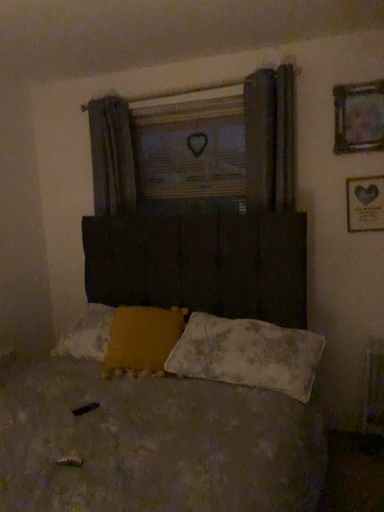
Measure the distance between point [110,376] and camera.

The depth of point [110,376] is 2.16 meters.

How much space does metallic silver picture frame at upper right, the 2th picture frame when ordered from bottom to top, occupy vertically?

The height of metallic silver picture frame at upper right, the 2th picture frame when ordered from bottom to top, is 14.92 inches.

At what (x,y) coordinates should I click in order to perform the action: click on worn fabric bed at center. Please return your answer as a coordinate pair (x, y). This screenshot has height=512, width=384. Looking at the image, I should click on (155, 445).

What do you see at coordinates (365, 204) in the screenshot? The width and height of the screenshot is (384, 512). I see `gold metallic picture frame at upper right, the 1th picture frame positioned from the bottom` at bounding box center [365, 204].

Locate an element on the screen. Image resolution: width=384 pixels, height=512 pixels. worn fabric pillow at lower center, arranged as the 2th pillow when viewed from the left is located at coordinates coord(247,354).

Considering the relative positions of metallic silver picture frame at upper right, the 2th picture frame when ordered from bottom to top, and wooden heart at center in the image provided, is metallic silver picture frame at upper right, the 2th picture frame when ordered from bottom to top, to the left or to the right of wooden heart at center?

From the image, it's evident that metallic silver picture frame at upper right, the 2th picture frame when ordered from bottom to top, is to the right of wooden heart at center.

From the image's perspective, relative to wooden heart at center, is metallic silver picture frame at upper right, the 1th picture frame from the top, above or below?

metallic silver picture frame at upper right, the 1th picture frame from the top, is situated higher than wooden heart at center in the image.

From a real-world perspective, is metallic silver picture frame at upper right, the 2th picture frame when ordered from bottom to top, physically below wooden heart at center?

No, from a real-world perspective, metallic silver picture frame at upper right, the 2th picture frame when ordered from bottom to top, is not below wooden heart at center.

Where is `window screen that is below the metallic silver picture frame at upper right, the 1th picture frame from the top (from the image's perspective)`? The width and height of the screenshot is (384, 512). window screen that is below the metallic silver picture frame at upper right, the 1th picture frame from the top (from the image's perspective) is located at coordinates (190, 148).

In the scene shown: Based on their positions, is metallic silver picture frame at upper right, the 2th picture frame when ordered from bottom to top, located to the left or right of gold metallic picture frame at upper right, the 1th picture frame positioned from the bottom?

Based on their positions, metallic silver picture frame at upper right, the 2th picture frame when ordered from bottom to top, is located to the left of gold metallic picture frame at upper right, the 1th picture frame positioned from the bottom.

Is metallic silver picture frame at upper right, the 1th picture frame from the top, facing away from gold metallic picture frame at upper right, the 1th picture frame positioned from the bottom?

No, metallic silver picture frame at upper right, the 1th picture frame from the top, is not facing away from gold metallic picture frame at upper right, the 1th picture frame positioned from the bottom.

In the scene shown: Would you say metallic silver picture frame at upper right, the 1th picture frame from the top, is outside gold metallic picture frame at upper right, which is the 2th picture frame in top-to-bottom order?

Yes, metallic silver picture frame at upper right, the 1th picture frame from the top, is outside of gold metallic picture frame at upper right, which is the 2th picture frame in top-to-bottom order.

Considering the sizes of objects metallic silver picture frame at upper right, the 1th picture frame from the top, and gold metallic picture frame at upper right, which is the 2th picture frame in top-to-bottom order, in the image provided, who is thinner, metallic silver picture frame at upper right, the 1th picture frame from the top, or gold metallic picture frame at upper right, which is the 2th picture frame in top-to-bottom order,?

gold metallic picture frame at upper right, which is the 2th picture frame in top-to-bottom order, is thinner.

From the image's perspective, between yellow fuzzy pillow at lower center, which is the first pillow from left to right, and worn fabric bed at center, who is located below?

worn fabric bed at center is shown below in the image.

How many degrees apart are the facing directions of yellow fuzzy pillow at lower center, which is the first pillow from left to right, and worn fabric bed at center?

The angle between the facing direction of yellow fuzzy pillow at lower center, which is the first pillow from left to right, and the facing direction of worn fabric bed at center is 17.7 degrees.

In terms of height, does yellow fuzzy pillow at lower center, positioned as the 2th pillow in right-to-left order, look taller or shorter compared to worn fabric bed at center?

yellow fuzzy pillow at lower center, positioned as the 2th pillow in right-to-left order, is shorter than worn fabric bed at center.

Who is bigger, yellow fuzzy pillow at lower center, positioned as the 2th pillow in right-to-left order, or worn fabric bed at center?

worn fabric bed at center.

Looking at the image, does gold metallic picture frame at upper right, which is the 2th picture frame in top-to-bottom order, seem bigger or smaller compared to metallic silver picture frame at upper right, the 1th picture frame from the top?

Considering their sizes, gold metallic picture frame at upper right, which is the 2th picture frame in top-to-bottom order, takes up less space than metallic silver picture frame at upper right, the 1th picture frame from the top.

From a real-world perspective, is gold metallic picture frame at upper right, the 1th picture frame positioned from the bottom, physically located above or below metallic silver picture frame at upper right, the 2th picture frame when ordered from bottom to top?

gold metallic picture frame at upper right, the 1th picture frame positioned from the bottom, is situated lower than metallic silver picture frame at upper right, the 2th picture frame when ordered from bottom to top, in the real world.

Measure the distance from gold metallic picture frame at upper right, the 1th picture frame positioned from the bottom, to metallic silver picture frame at upper right, the 2th picture frame when ordered from bottom to top.

They are 12.64 inches apart.

Is point (382, 198) positioned in front of point (336, 124)?

Yes, it is in front of point (336, 124).

Considering the positions of point (379, 201) and point (67, 368), is point (379, 201) closer or farther from the camera than point (67, 368)?

Point (379, 201) appears to be farther away from the viewer than point (67, 368).

From the image's perspective, which is below, gold metallic picture frame at upper right, the 1th picture frame positioned from the bottom, or worn fabric bed at center?

worn fabric bed at center is shown below in the image.

Does gold metallic picture frame at upper right, which is the 2th picture frame in top-to-bottom order, appear on the right side of worn fabric bed at center?

Yes.

From a real-world perspective, is gold metallic picture frame at upper right, the 1th picture frame positioned from the bottom, positioned over worn fabric bed at center based on gravity?

Yes, from a real-world perspective, gold metallic picture frame at upper right, the 1th picture frame positioned from the bottom, is above worn fabric bed at center.

Considering the positions of objects gold metallic picture frame at upper right, the 1th picture frame positioned from the bottom, and worn fabric pillow at lower center, arranged as the 2th pillow when viewed from the left, in the image provided, who is behind, gold metallic picture frame at upper right, the 1th picture frame positioned from the bottom, or worn fabric pillow at lower center, arranged as the 2th pillow when viewed from the left,?

Positioned behind is gold metallic picture frame at upper right, the 1th picture frame positioned from the bottom.

From a real-world perspective, is gold metallic picture frame at upper right, the 1th picture frame positioned from the bottom, above or below worn fabric pillow at lower center, the first pillow viewed from the right?

gold metallic picture frame at upper right, the 1th picture frame positioned from the bottom, is situated higher than worn fabric pillow at lower center, the first pillow viewed from the right, in the real world.

Which object is wider, gold metallic picture frame at upper right, the 1th picture frame positioned from the bottom, or worn fabric pillow at lower center, the first pillow viewed from the right?

worn fabric pillow at lower center, the first pillow viewed from the right, is wider.

Is gold metallic picture frame at upper right, which is the 2th picture frame in top-to-bottom order, not within worn fabric pillow at lower center, arranged as the 2th pillow when viewed from the left?

Yes.

Which is in front, point (293, 362) or point (381, 207)?

The point (293, 362) is closer.

Which object is positioned more to the left, worn fabric pillow at lower center, the first pillow viewed from the right, or gold metallic picture frame at upper right, which is the 2th picture frame in top-to-bottom order?

Positioned to the left is worn fabric pillow at lower center, the first pillow viewed from the right.

Between worn fabric pillow at lower center, the first pillow viewed from the right, and gold metallic picture frame at upper right, which is the 2th picture frame in top-to-bottom order, which one has larger width?

With larger width is worn fabric pillow at lower center, the first pillow viewed from the right.

Who is more distant, worn fabric pillow at lower center, arranged as the 2th pillow when viewed from the left, or gold metallic picture frame at upper right, the 1th picture frame positioned from the bottom?

Positioned behind is gold metallic picture frame at upper right, the 1th picture frame positioned from the bottom.

In order to click on window screen on the left side of metallic silver picture frame at upper right, the 2th picture frame when ordered from bottom to top in this screenshot , I will do `click(190, 148)`.

In order to click on picture frame on the right of metallic silver picture frame at upper right, the 1th picture frame from the top in this screenshot , I will do `click(365, 204)`.

From the image, which object appears to be nearer to metallic silver picture frame at upper right, the 1th picture frame from the top, gold metallic picture frame at upper right, which is the 2th picture frame in top-to-bottom order, or worn fabric pillow at lower center, arranged as the 2th pillow when viewed from the left?

Based on the image, gold metallic picture frame at upper right, which is the 2th picture frame in top-to-bottom order, appears to be nearer to metallic silver picture frame at upper right, the 1th picture frame from the top.

Considering their positions, is worn fabric pillow at lower center, arranged as the 2th pillow when viewed from the left, positioned closer to wooden heart at center than gold metallic picture frame at upper right, which is the 2th picture frame in top-to-bottom order?

The object closer to wooden heart at center is gold metallic picture frame at upper right, which is the 2th picture frame in top-to-bottom order.

From the image, which object appears to be farther from worn fabric bed at center, metallic silver picture frame at upper right, the 1th picture frame from the top, or wooden heart at center?

metallic silver picture frame at upper right, the 1th picture frame from the top.

Looking at this image, based on their spatial positions, is yellow fuzzy pillow at lower center, positioned as the 2th pillow in right-to-left order, or worn fabric pillow at lower center, the first pillow viewed from the right, further from worn fabric bed at center?

yellow fuzzy pillow at lower center, positioned as the 2th pillow in right-to-left order, lies further to worn fabric bed at center than the other object.

Which object lies further to the anchor point yellow fuzzy pillow at lower center, positioned as the 2th pillow in right-to-left order, worn fabric pillow at lower center, arranged as the 2th pillow when viewed from the left, or worn fabric bed at center?

Based on the image, worn fabric bed at center appears to be further to yellow fuzzy pillow at lower center, positioned as the 2th pillow in right-to-left order.

Considering their positions, is worn fabric pillow at lower center, the first pillow viewed from the right, positioned closer to metallic silver picture frame at upper right, the 1th picture frame from the top, than wooden heart at center?

Among the two, wooden heart at center is located nearer to metallic silver picture frame at upper right, the 1th picture frame from the top.

Considering their positions, is worn fabric pillow at lower center, arranged as the 2th pillow when viewed from the left, positioned closer to worn fabric bed at center than gold metallic picture frame at upper right, which is the 2th picture frame in top-to-bottom order?

Among the two, worn fabric pillow at lower center, arranged as the 2th pillow when viewed from the left, is located nearer to worn fabric bed at center.

Looking at the image, which one is located further to metallic silver picture frame at upper right, the 1th picture frame from the top, yellow fuzzy pillow at lower center, positioned as the 2th pillow in right-to-left order, or worn fabric pillow at lower center, arranged as the 2th pillow when viewed from the left?

Answer: The object further to metallic silver picture frame at upper right, the 1th picture frame from the top, is yellow fuzzy pillow at lower center, positioned as the 2th pillow in right-to-left order.

I want to click on pillow between metallic silver picture frame at upper right, the 1th picture frame from the top, and worn fabric pillow at lower center, the first pillow viewed from the right, vertically, so click(142, 340).

I want to click on picture frame between yellow fuzzy pillow at lower center, positioned as the 2th pillow in right-to-left order, and gold metallic picture frame at upper right, the 1th picture frame positioned from the bottom, so click(359, 117).

This screenshot has height=512, width=384. Identify the location of pillow that lies between wooden heart at center and worn fabric pillow at lower center, arranged as the 2th pillow when viewed from the left, from top to bottom. (142, 340).

The height and width of the screenshot is (512, 384). Find the location of `picture frame between wooden heart at center and gold metallic picture frame at upper right, the 1th picture frame positioned from the bottom`. picture frame between wooden heart at center and gold metallic picture frame at upper right, the 1th picture frame positioned from the bottom is located at coordinates (359, 117).